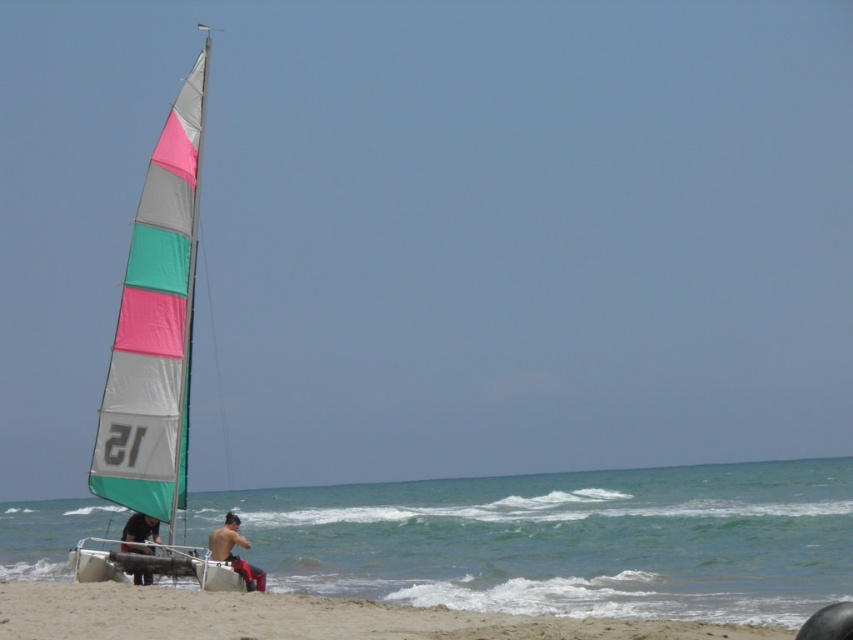
Question: Can you confirm if green water at lower left is smaller than dark brown leather jacket at lower left?

Choices:
 (A) no
 (B) yes

Answer: (A)

Question: Which object is positioned closest to the multicolored fabric sailboat at left?

Choices:
 (A) sandy beach at lower left
 (B) green water at lower left
 (C) dark brown leather jacket at lower left

Answer: (C)

Question: Does sandy beach at lower left come in front of dark brown leather jacket at lower left?

Choices:
 (A) no
 (B) yes

Answer: (B)

Question: Which point is closer to the camera?

Choices:
 (A) (627, 515)
 (B) (233, 536)
 (C) (138, 422)

Answer: (B)

Question: Among these points, which one is farthest from the camera?

Choices:
 (A) click(138, 515)
 (B) click(190, 634)
 (C) click(215, 540)
 (D) click(508, 600)

Answer: (D)

Question: Does sandy beach at lower left have a smaller size compared to dark brown leather jacket at lower left?

Choices:
 (A) yes
 (B) no

Answer: (A)